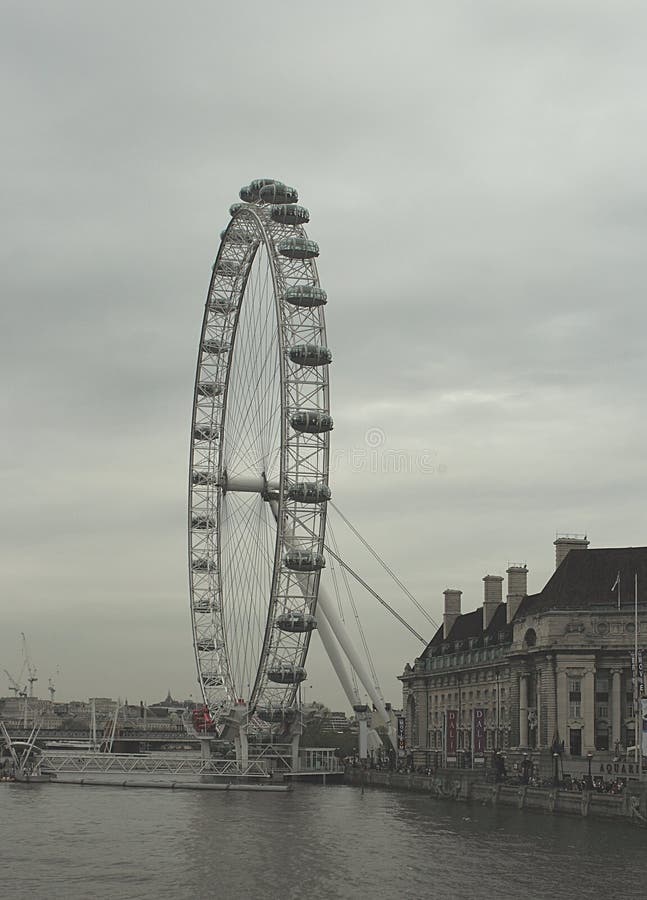
Find the location of a particular element. Image resolution: width=647 pixels, height=900 pixels. pillars is located at coordinates point(615,707), point(584,682), point(565,705), point(521,707).